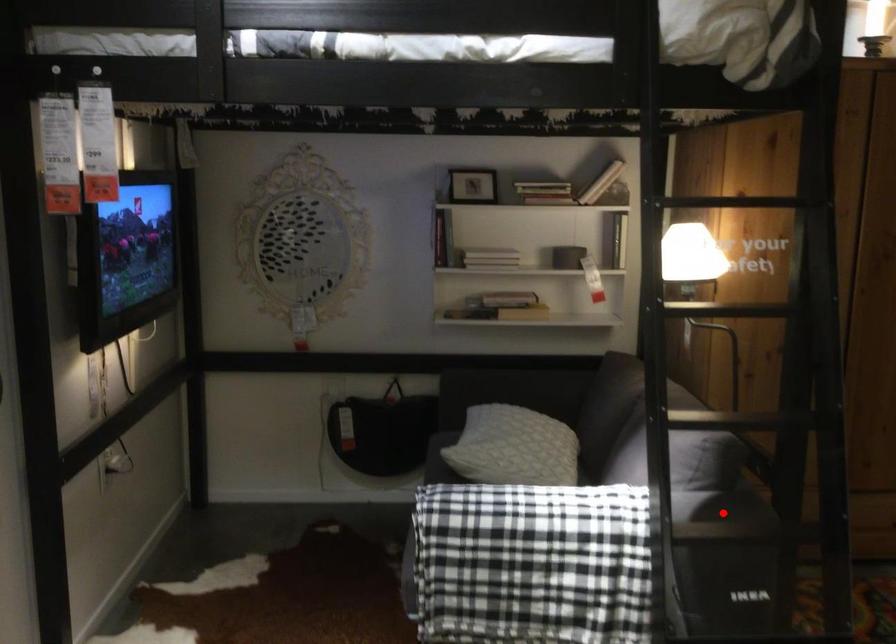
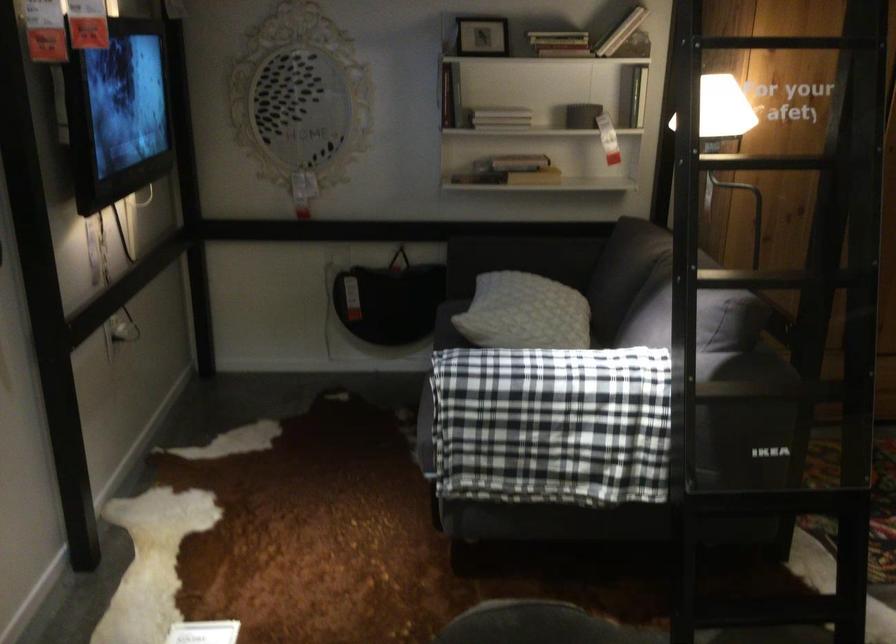
In the second image, find the point that corresponds to the highlighted location in the first image.

(745, 366)